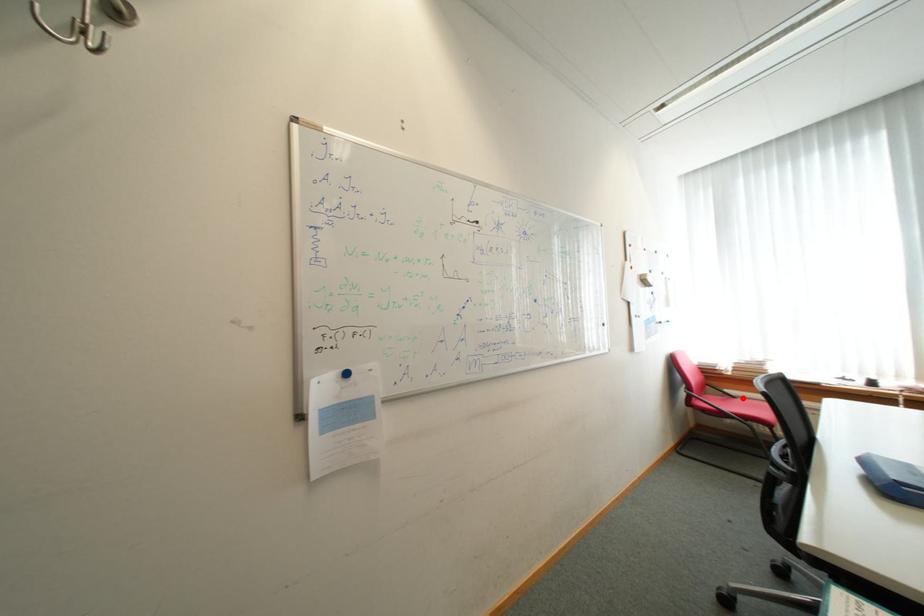
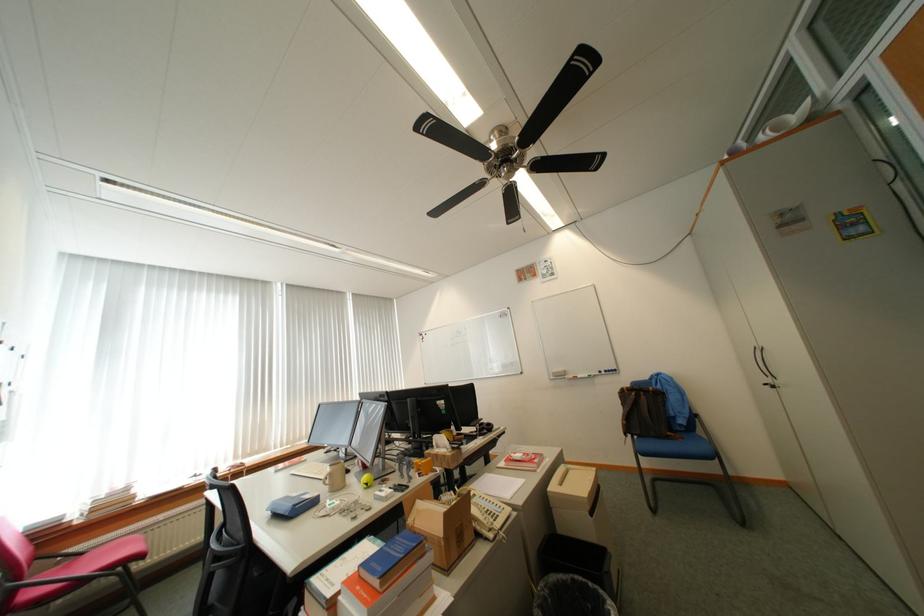
Locate, in the second image, the point that corresponds to the highlighted location in the first image.

(91, 554)